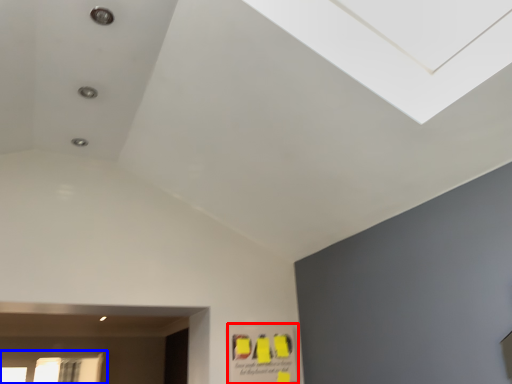
Question: Which of the following is the closest to the observer, poster (highlighted by a red box) or window (highlighted by a blue box)?

Choices:
 (A) poster
 (B) window

Answer: (A)